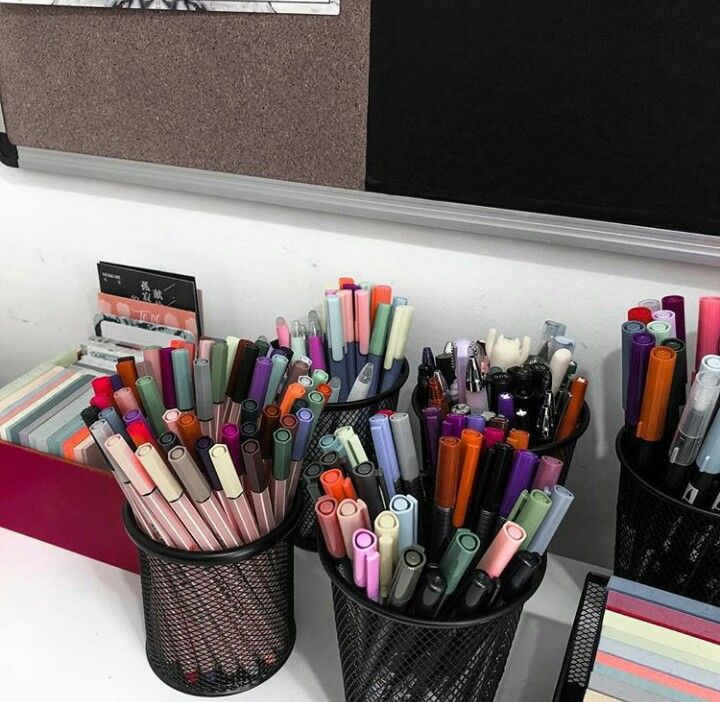
Where is `blackboard`? blackboard is located at coordinates (474, 185).